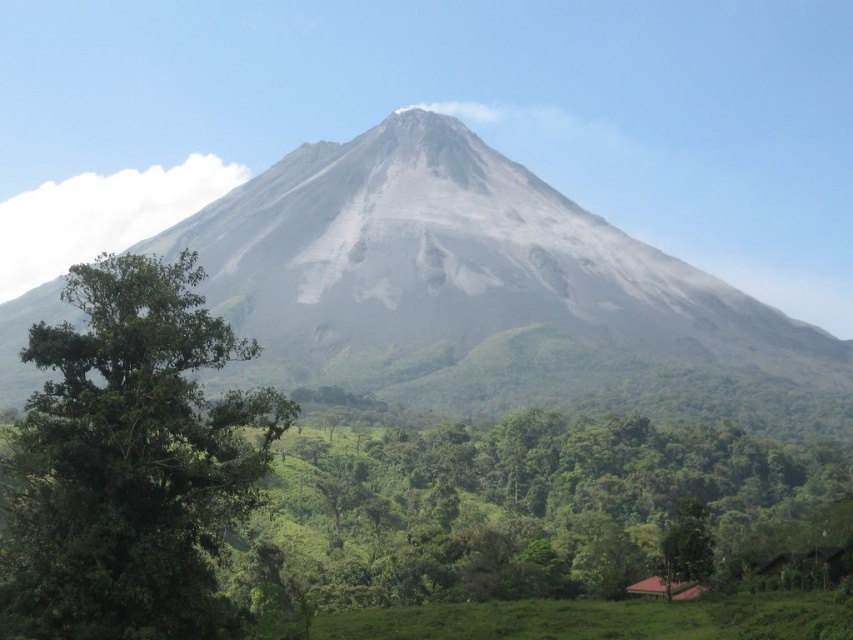
You are a hiker planning to take a photo of the volcano with both the green leafy tree at left and the green leafy tree at lower right in the frame. Which tree should you stand closer to in order to include both in your photo?

You should stand closer to the green leafy tree at lower right because it is smaller in size compared to the green leafy tree at left. By positioning yourself nearer to the smaller tree, you can ensure both trees are visible within the frame while maintaining balance between their sizes in the photograph.

You are standing at the base of the volcanic mountain and want to reach the peak. There are two points marked on your map, point (744, 346) and point (80, 276). Which point is closer to the peak?

Point (744, 346) is further to the viewer than point (80, 276), so the point closer to the peak is point (80, 276).